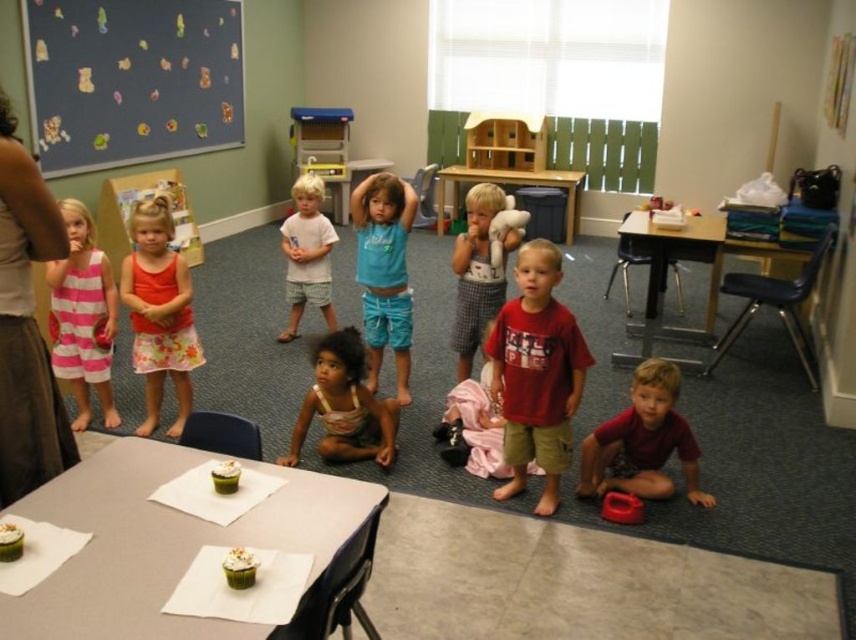
You are standing at the entrance of the classroom and want to find the blue cotton shirt at center. According to the coordinates provided, where should you look relative to the classroom entrance?

The blue cotton shirt at center is located at coordinates 0.425 on the x axis and 0.450 on the y axis, so you should look towards the center of the classroom, slightly to the right and forward from the entrance.

Consider the image. You are standing in the classroom and want to hand out snacks to the children. The matte red shirt at lower right and the blue cotton shirt at center are both facing you. Which child should you approach first to ensure you can reach them without moving around other chairs?

The matte red shirt at lower right is closer to the viewer than the blue cotton shirt at center, so you should approach the child wearing the matte red shirt at lower right first since they are nearer and more accessible.